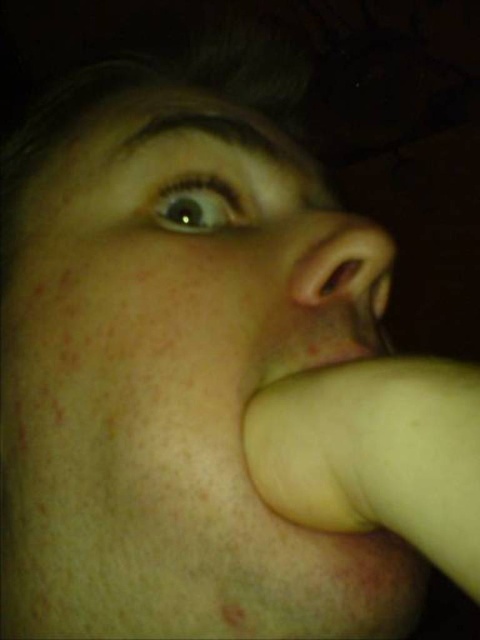
You are a dermatologist analyzing a patient photo. The patient has a point marked at coordinates point (346,266). Based on the image description, what feature is located at that point?

The point (346,266) is located at the smooth skin nose at center.

Based on the scene description, can you determine the spatial relationship between the smooth skin nose at center and the smooth yellowish flesh at lower center?

The smooth skin nose at center is above the smooth yellowish flesh at lower center.

You are a photographer adjusting lighting for a portrait. You notice the smooth yellow hand at lower right and the smooth yellowish flesh at lower center in the frame. Which object is nearer to the camera?

The smooth yellow hand at lower right is closer to the viewer than the smooth yellowish flesh at lower center.